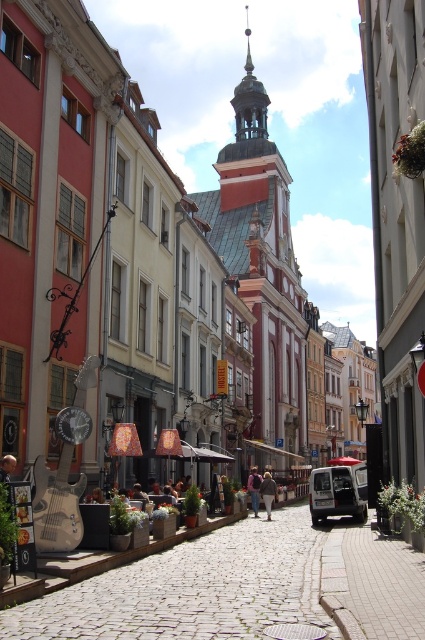
Does brown leather jacket at center have a lesser width compared to smooth wooden guitar at left?

No, brown leather jacket at center is not thinner than smooth wooden guitar at left.

Between point (275, 486) and point (3, 461), which one is positioned behind?

Point (275, 486)

Where is `brown leather jacket at center`? The image size is (425, 640). brown leather jacket at center is located at coordinates (268, 492).

Based on the photo, which is above, cobblestone alley at center or smooth wooden guitar at left?

smooth wooden guitar at left is above.

This screenshot has height=640, width=425. Identify the location of cobblestone alley at center. (240, 588).

Does white matte van at center have a lesser width compared to dark brown leather jacket at center?

No, white matte van at center is not thinner than dark brown leather jacket at center.

Which is behind, point (325, 497) or point (254, 465)?

The point (254, 465) is behind.

This screenshot has width=425, height=640. Identify the location of white matte van at center. (339, 490).